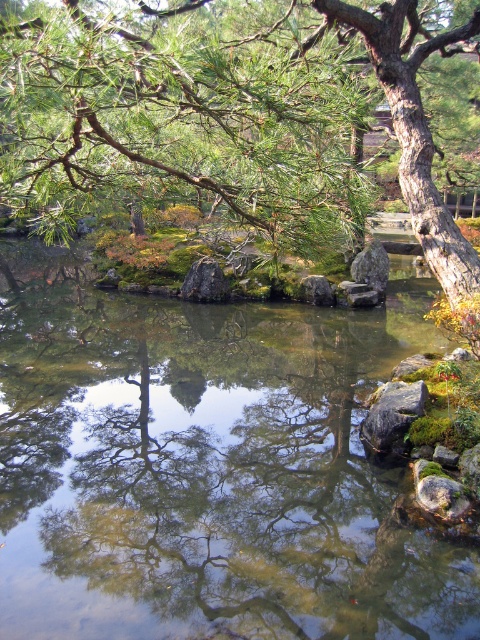
Between clear water at center and gray rock at center, which one is positioned higher?

gray rock at center

From the picture: Does clear water at center lie in front of gray rock at center?

Yes.

Where is `clear water at center`? The width and height of the screenshot is (480, 640). clear water at center is located at coordinates (207, 467).

Can you confirm if gray rock at center is bigger than gray rough stone at center?

Correct, gray rock at center is larger in size than gray rough stone at center.

Which is below, gray rock at center or gray rough stone at center?

gray rough stone at center

Is point (213, 284) positioned in front of point (309, 300)?

That is True.

At what (x,y) coordinates should I click in order to perform the action: click on gray rock at center. Please return your answer as a coordinate pair (x, y). Image resolution: width=480 pixels, height=640 pixels. Looking at the image, I should click on (204, 282).

Does clear water at center have a lesser height compared to green needle-like branches at upper center?

In fact, clear water at center may be taller than green needle-like branches at upper center.

Measure the distance between point [140,348] and camera.

9.54 meters

Who is more distant from viewer, (458, 548) or (153, 120)?

The point (458, 548) is more distant.

Where is `clear water at center`? clear water at center is located at coordinates (207, 467).